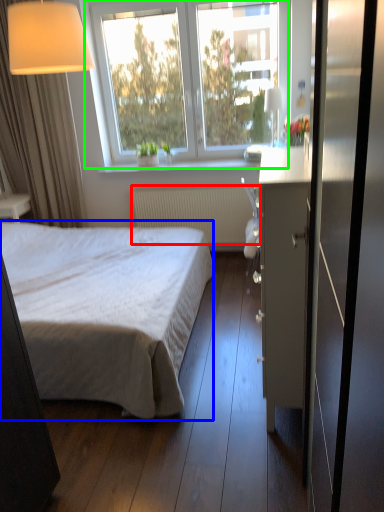
Question: Considering the real-world distances, which object is farthest from radiator (highlighted by a red box)? bed (highlighted by a blue box) or window (highlighted by a green box)?

Choices:
 (A) bed
 (B) window

Answer: (A)